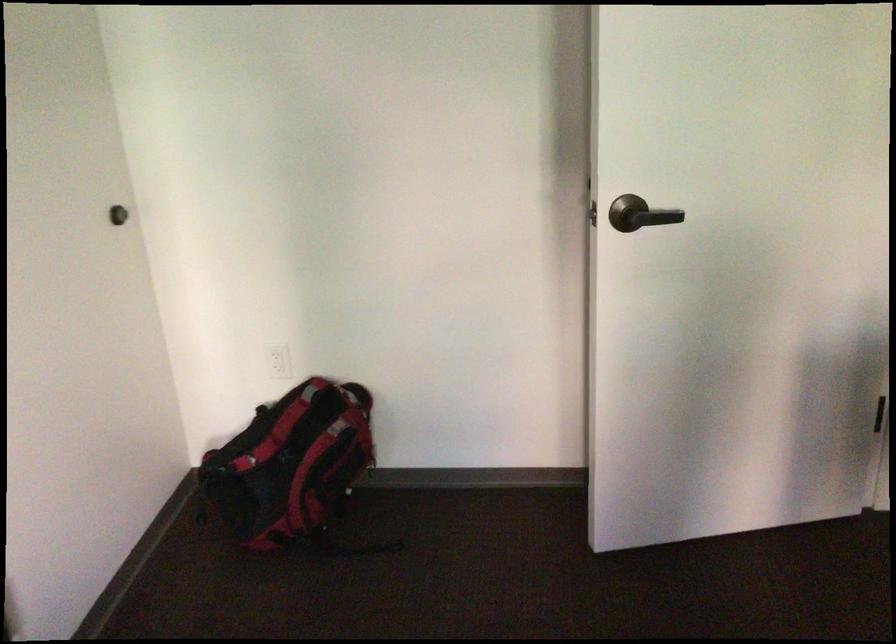
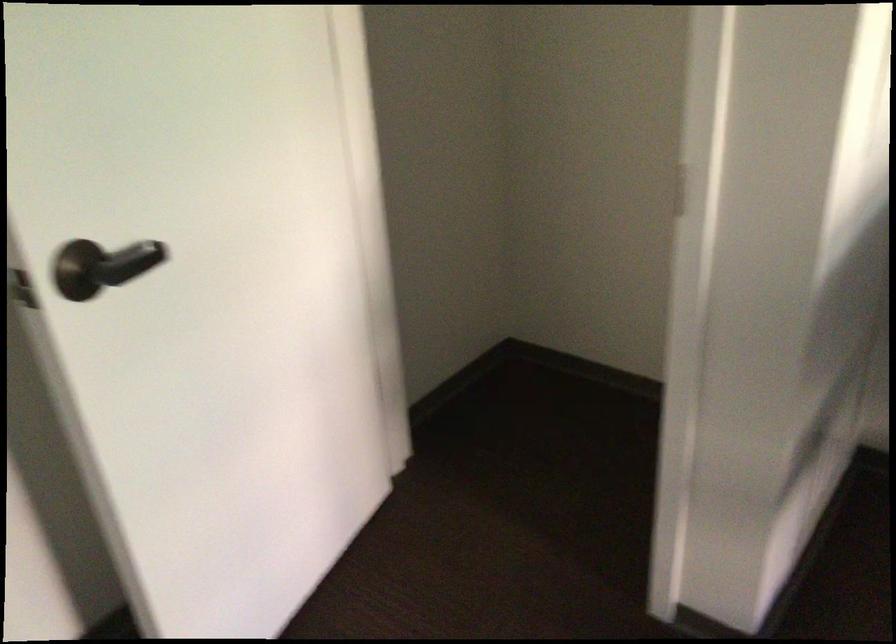
Question: The first image is from the beginning of the video and the second image is from the end. How did the camera likely rotate when shooting the video?

Choices:
 (A) Left
 (B) Right
 (C) Up
 (D) Down

Answer: (B)